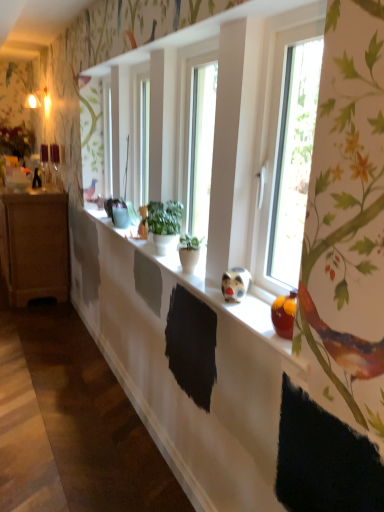
Question: Is green matte plant pot at center, which is counted as the 1th houseplant, starting from the front, at the back of green matte plant at center, placed as the second houseplant when sorted from front to back?

Choices:
 (A) no
 (B) yes

Answer: (A)

Question: Can you confirm if green matte plant at center, placed as the second houseplant when sorted from front to back, is taller than green matte plant pot at center, positioned as the second houseplant in back-to-front order?

Choices:
 (A) no
 (B) yes

Answer: (B)

Question: Can we say green matte plant at center, placed as the second houseplant when sorted from front to back, lies outside green matte plant pot at center, which is counted as the 1th houseplant, starting from the front?

Choices:
 (A) no
 (B) yes

Answer: (B)

Question: Is green matte plant at center, the first houseplant from the back, not near green matte plant pot at center, positioned as the second houseplant in back-to-front order?

Choices:
 (A) yes
 (B) no

Answer: (B)

Question: Does green matte plant at center, placed as the second houseplant when sorted from front to back, appear on the left side of green matte plant pot at center, positioned as the second houseplant in back-to-front order?

Choices:
 (A) no
 (B) yes

Answer: (B)

Question: In the image, is transparent glass window at right on the left side or the right side of green matte plant at center, placed as the second houseplant when sorted from front to back?

Choices:
 (A) right
 (B) left

Answer: (A)

Question: Is transparent glass window at right bigger or smaller than green matte plant at center, the first houseplant from the back?

Choices:
 (A) big
 (B) small

Answer: (A)

Question: From a real-world perspective, is transparent glass window at right physically located above or below green matte plant at center, placed as the second houseplant when sorted from front to back?

Choices:
 (A) below
 (B) above

Answer: (B)

Question: Which is correct: transparent glass window at right is inside green matte plant at center, the first houseplant from the back, or outside of it?

Choices:
 (A) outside
 (B) inside

Answer: (A)

Question: In terms of width, does white matte window sill at center look wider or thinner when compared to transparent glass window at right?

Choices:
 (A) thin
 (B) wide

Answer: (B)

Question: Is white matte window sill at center in front of or behind transparent glass window at right in the image?

Choices:
 (A) behind
 (B) front

Answer: (A)

Question: Is white matte window sill at center spatially inside transparent glass window at right, or outside of it?

Choices:
 (A) outside
 (B) inside

Answer: (A)

Question: From a real-world perspective, is white matte window sill at center above or below transparent glass window at right?

Choices:
 (A) above
 (B) below

Answer: (B)

Question: From the image's perspective, relative to green matte plant pot at center, positioned as the second houseplant in back-to-front order, is transparent glass window at right above or below?

Choices:
 (A) above
 (B) below

Answer: (A)

Question: From a real-world perspective, is transparent glass window at right positioned above or below green matte plant pot at center, which is counted as the 1th houseplant, starting from the front?

Choices:
 (A) below
 (B) above

Answer: (B)